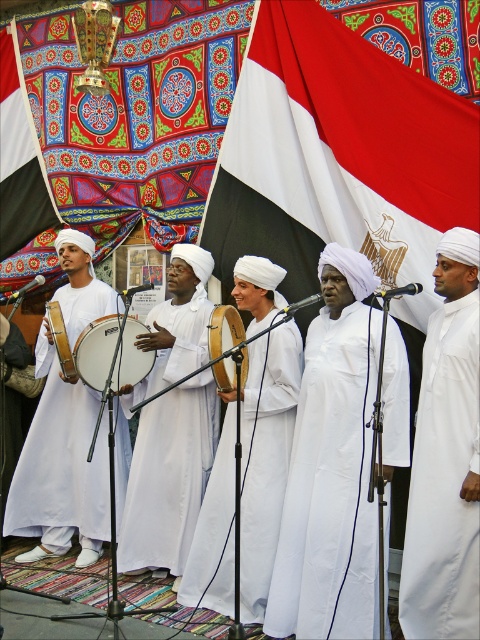
You are a photographer trying to capture a photo of the performers. You want to ensure that both the white matte robe at right and the wooden drum at left are clearly visible in the frame. Based on their positions, which object should you focus on first to ensure both are in focus?

Since the white matte robe at right is to the right of the wooden drum at left, you should focus on the wooden drum at left first. This way, the distance between the two objects is accounted for, ensuring both are in focus when centered properly.

Based on the photo, you are a photographer planning to take a group photo of the musicians. You notice the white matte robe at right and the white cotton choir at center. Which clothing item appears narrower in width when viewed from the front?

The white matte robe at right is thinner than the white cotton choir at center, so the white matte robe at right appears narrower in width when viewed from the front.

You are a photographer trying to capture the Egyptian flag in the scene. The flag is located at point (20, 157). Which object from the following list is at that coordinate? Choose from the options below. The options are the white fabric flag at upper left, the vibrant tapestry with intricate patterns in red, blue, green, and gold, and the five individuals dressed in traditional white attire.

The point (20, 157) corresponds to the white fabric flag at upper left.